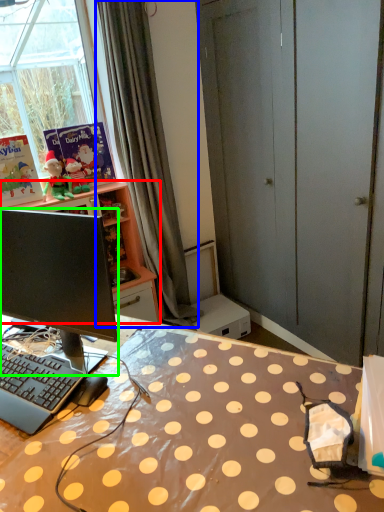
Question: Based on their relative distances, which object is nearer to cabinetry (highlighted by a red box)? Choose from curtain (highlighted by a blue box) and computer monitor (highlighted by a green box).

Choices:
 (A) curtain
 (B) computer monitor

Answer: (A)